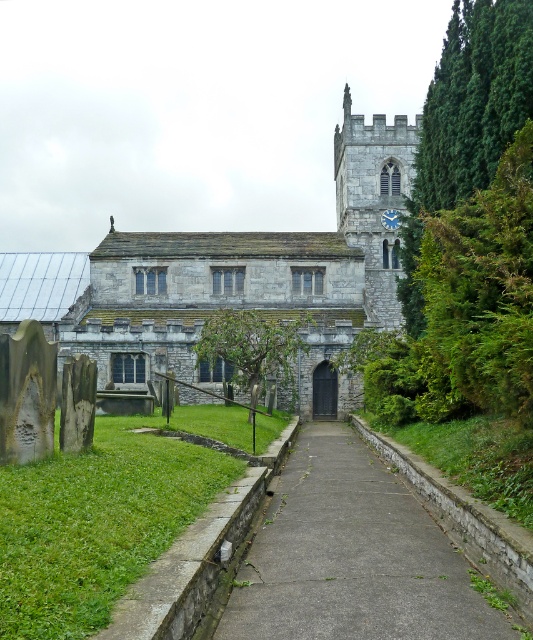
What do you see at coordinates (233, 276) in the screenshot?
I see `gray stone church at center` at bounding box center [233, 276].

Identify the location of gray stone church at center. The height and width of the screenshot is (640, 533). (233, 276).

Is point (110, 307) positioned after point (346, 492)?

Yes.

This screenshot has height=640, width=533. Identify the location of gray stone church at center. 233,276.